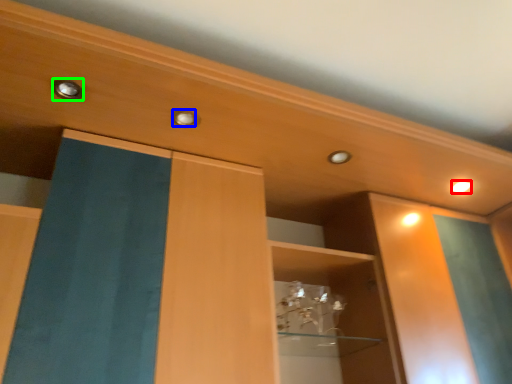
Question: Based on their relative distances, which object is farther from lighting (highlighted by a red box)? Choose from knob (highlighted by a blue box) and knob (highlighted by a green box).

Choices:
 (A) knob
 (B) knob

Answer: (B)